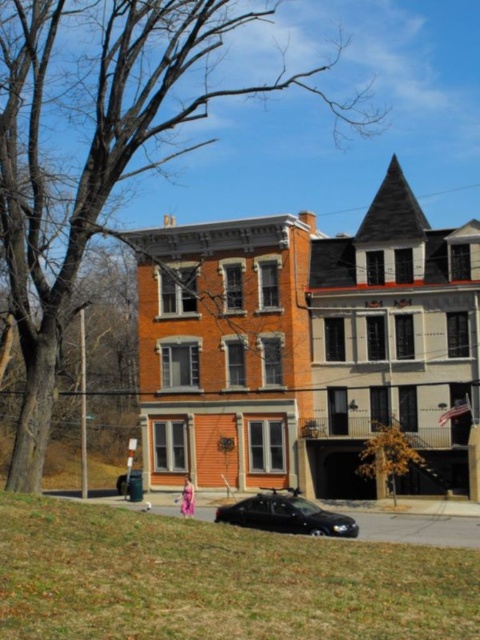
Is green grass at lower left above shiny black sedan at center?

Correct, green grass at lower left is located above shiny black sedan at center.

Who is positioned more to the left, green grass at lower left or shiny black sedan at center?

From the viewer's perspective, green grass at lower left appears more on the left side.

Locate an element on the screen. Image resolution: width=480 pixels, height=640 pixels. green grass at lower left is located at coordinates 217,580.